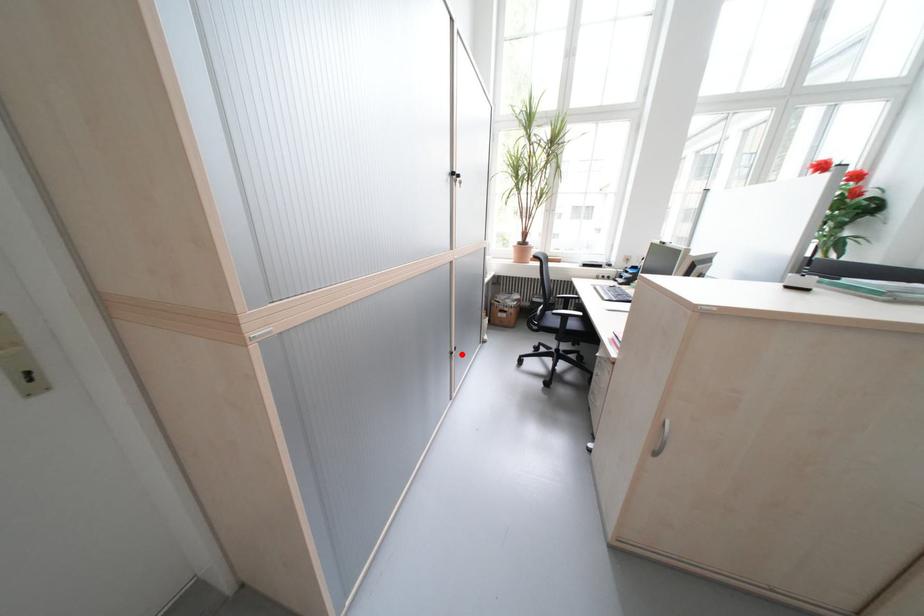
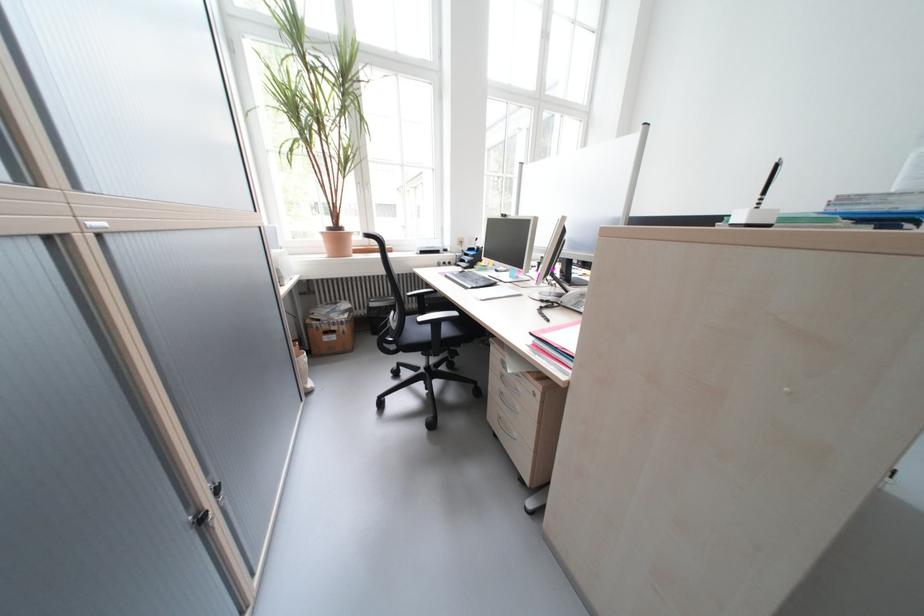
Question: I am providing you with two images of the same scene from different viewpoints. A red point is marked on the first image. Is the red point's position out of view in image 2?

Choices:
 (A) Yes
 (B) No

Answer: (B)